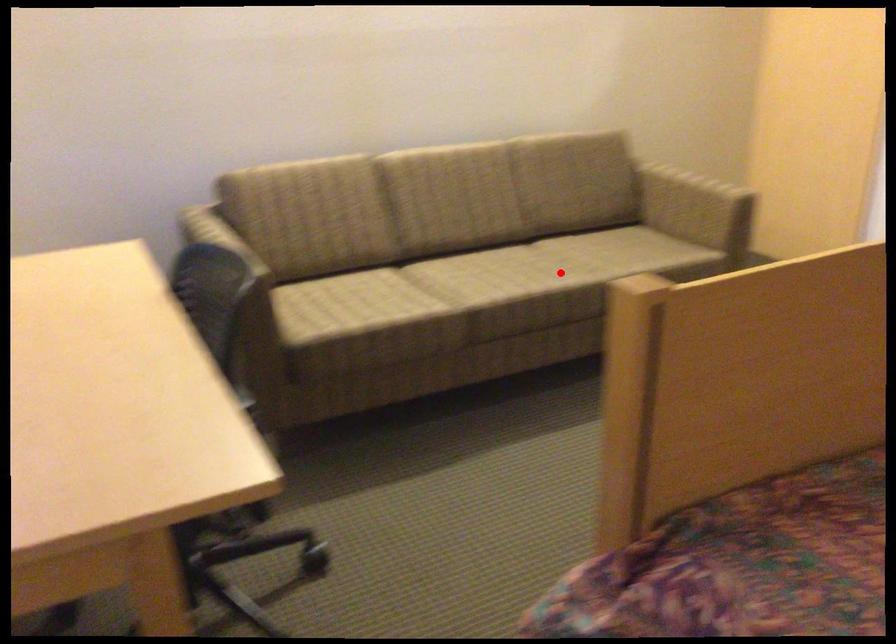
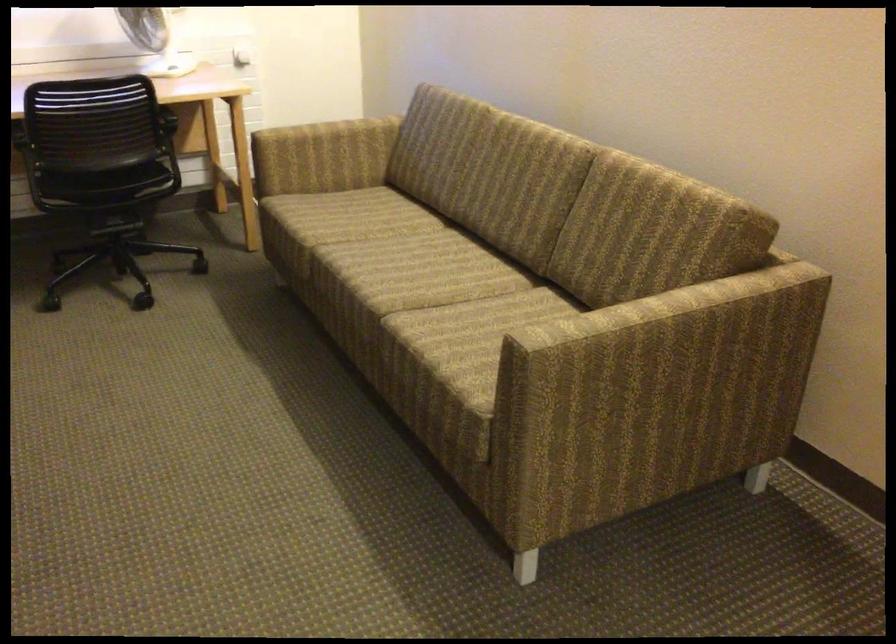
In the second image, find the point that corresponds to the highlighted location in the first image.

(395, 289)